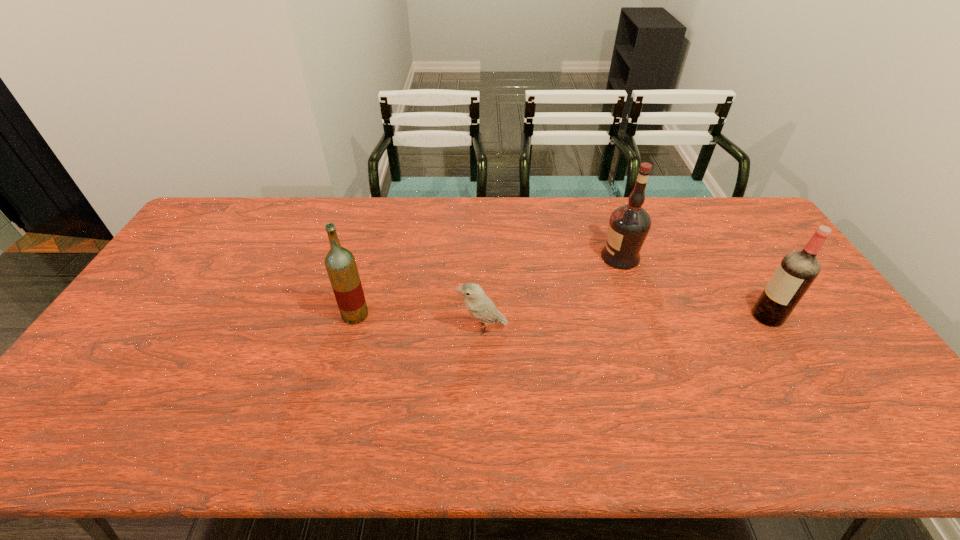
You are a GUI agent. You are given a task and a screenshot of the screen. Output one action in this format:
    pyautogui.click(x=<x>, y=<y>)
    Task: Click on the blank area at the right edge
    The width and height of the screenshot is (960, 540).
    Given the screenshot: What is the action you would take?
    pyautogui.click(x=821, y=374)

Find the location of a particular element. free spot at the far right corner of the desktop is located at coordinates (727, 197).

Where is `free space between the rightmost liquor and the shortest object`? This screenshot has width=960, height=540. free space between the rightmost liquor and the shortest object is located at coordinates (625, 322).

Find the location of `vacant region between the farthest object and the leftmost object`. vacant region between the farthest object and the leftmost object is located at coordinates (488, 286).

The height and width of the screenshot is (540, 960). In order to click on free space between the third object from left to right and the shortest object in this screenshot , I will do `click(551, 292)`.

Identify the location of free spot between the farthest liquor and the leftmost liquor. This screenshot has height=540, width=960. (488, 286).

Find the location of a particular element. Image resolution: width=960 pixels, height=540 pixels. vacant area between the leftmost liquor and the rightmost liquor is located at coordinates tap(562, 315).

The image size is (960, 540). I want to click on free space between the bird and the rightmost liquor, so click(625, 322).

Where is `vacant space in between the third object from right to left and the rightmost liquor`? This screenshot has width=960, height=540. vacant space in between the third object from right to left and the rightmost liquor is located at coordinates (625, 322).

This screenshot has height=540, width=960. Find the location of `empty space between the farthest liquor and the shortest object`. empty space between the farthest liquor and the shortest object is located at coordinates (551, 292).